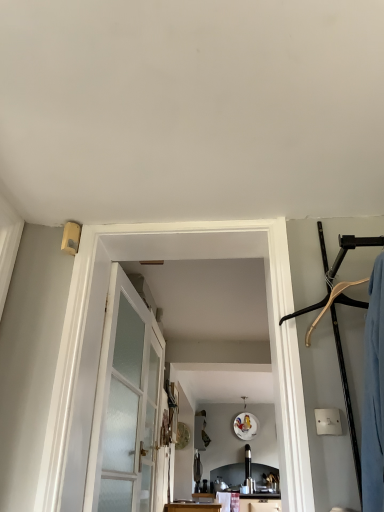
Describe the element at coordinates (150, 428) in the screenshot. I see `clear glass door at center` at that location.

Measure the distance between satin glass door at center and camera.

They are 1.54 meters apart.

Describe the element at coordinates (98, 347) in the screenshot. The width and height of the screenshot is (384, 512). I see `white frosted glass barn door at center` at that location.

Where is `white frosted glass barn door at center`? white frosted glass barn door at center is located at coordinates (98, 347).

Locate an element on the screen. The image size is (384, 512). clear glass door at center is located at coordinates (150, 428).

Is clear glass door at center surrounded by satin glass door at center?

No, clear glass door at center is located outside of satin glass door at center.

Is satin glass door at center positioned far away from clear glass door at center?

That's not correct — satin glass door at center is a little close to clear glass door at center.

Find the location of a particular element. screen door lying on the right of satin glass door at center is located at coordinates (150, 428).

Between satin glass door at center and clear glass door at center, which one has larger width?

satin glass door at center is wider.

Is point (120, 327) less distant than point (56, 502)?

No, it is behind (56, 502).

Is satin glass door at center oriented away from white frosted glass barn door at center?

No, satin glass door at center's orientation is not away from white frosted glass barn door at center.

Which of these two, satin glass door at center or white frosted glass barn door at center, stands shorter?

With less height is satin glass door at center.

From the image's perspective, which is below, satin glass door at center or white frosted glass barn door at center?

From the image's view, satin glass door at center is below.

In the image, is white frosted glass barn door at center on the left side or the right side of satin glass door at center?

white frosted glass barn door at center is positioned on satin glass door at center's right side.

Can you see white frosted glass barn door at center touching satin glass door at center?

No, white frosted glass barn door at center is not next to satin glass door at center.

Between white frosted glass barn door at center and satin glass door at center, which one is positioned behind?

satin glass door at center is more distant.

At what (x,y) coordinates should I click in order to perform the action: click on barn door above the satin glass door at center (from a real-world perspective). Please return your answer as a coordinate pair (x, y). The width and height of the screenshot is (384, 512). Looking at the image, I should click on (98, 347).

From a real-world perspective, which object stands above the other?

white frosted glass barn door at center.

Is white frosted glass barn door at center oriented away from clear glass door at center?

Yes, white frosted glass barn door at center is positioned with its back facing clear glass door at center.

From the picture: Who is shorter, white frosted glass barn door at center or clear glass door at center?

Standing shorter between the two is white frosted glass barn door at center.

Is white frosted glass barn door at center with clear glass door at center?

No, white frosted glass barn door at center is not next to clear glass door at center.

From the image's perspective, between clear glass door at center and white frosted glass barn door at center, who is located below?

clear glass door at center.

Is white frosted glass barn door at center at the back of clear glass door at center?

clear glass door at center does not have its back to white frosted glass barn door at center.

Could white frosted glass barn door at center be considered to be inside clear glass door at center?

No, clear glass door at center does not contain white frosted glass barn door at center.

Which of these two, clear glass door at center or white frosted glass barn door at center, stands shorter?

Standing shorter between the two is white frosted glass barn door at center.

Is point (147, 391) positioned before point (134, 445)?

No, (147, 391) is further to viewer.

Considering the sizes of objects clear glass door at center and satin glass door at center in the image provided, who is wider, clear glass door at center or satin glass door at center?

satin glass door at center.

From the picture: Is clear glass door at center not inside satin glass door at center?

clear glass door at center lies outside satin glass door at center's area.

Image resolution: width=384 pixels, height=512 pixels. What are the coordinates of `screen door that is behind the satin glass door at center` in the screenshot? It's located at (150, 428).

This screenshot has width=384, height=512. Find the location of `door that appears below the white frosted glass barn door at center (from the image's perspective)`. door that appears below the white frosted glass barn door at center (from the image's perspective) is located at coordinates (126, 405).

From the image, which object appears to be nearer to clear glass door at center, white frosted glass barn door at center or satin glass door at center?

satin glass door at center is closer to clear glass door at center.

Considering their positions, is clear glass door at center positioned further to satin glass door at center than white frosted glass barn door at center?

white frosted glass barn door at center is positioned further to the anchor satin glass door at center.

Based on the photo, considering their positions, is satin glass door at center positioned closer to white frosted glass barn door at center than clear glass door at center?

satin glass door at center.

From the image, which object appears to be farther from white frosted glass barn door at center, clear glass door at center or satin glass door at center?

The object further to white frosted glass barn door at center is clear glass door at center.

When comparing their distances from clear glass door at center, does satin glass door at center or white frosted glass barn door at center seem closer?

The object closer to clear glass door at center is satin glass door at center.

Considering their positions, is white frosted glass barn door at center positioned closer to satin glass door at center than clear glass door at center?

Based on the image, clear glass door at center appears to be nearer to satin glass door at center.

Find the location of a particular element. This screenshot has width=384, height=512. door between white frosted glass barn door at center and clear glass door at center from front to back is located at coordinates (126, 405).